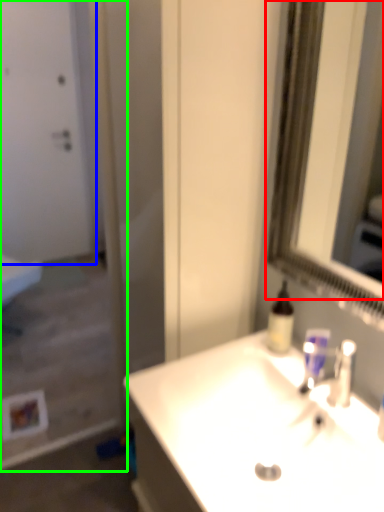
Question: Which object is positioned farthest from mirror (highlighted by a red box)? Select from door (highlighted by a blue box) and screen door (highlighted by a green box).

Choices:
 (A) door
 (B) screen door

Answer: (A)